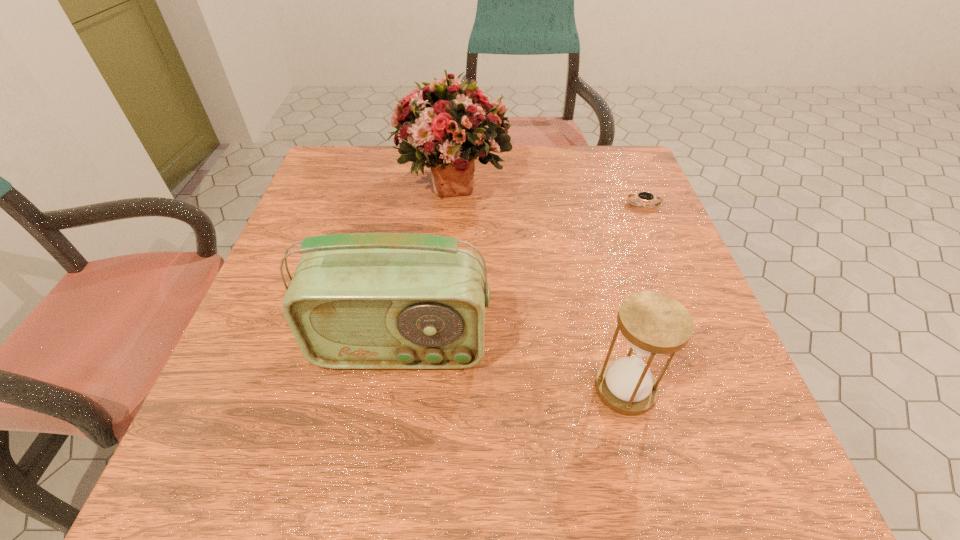
I want to click on bouquet, so click(x=449, y=125).

At what (x,y) coordinates should I click in order to perform the action: click on radio receiver. Please return your answer as a coordinate pair (x, y). The image size is (960, 540). Looking at the image, I should click on (379, 300).

Locate an element on the screen. This screenshot has height=540, width=960. hourglass is located at coordinates (653, 323).

At what (x,y) coordinates should I click in order to perform the action: click on the second shortest object. Please return your answer as a coordinate pair (x, y). Image resolution: width=960 pixels, height=540 pixels. Looking at the image, I should click on (653, 323).

The width and height of the screenshot is (960, 540). Identify the location of watch. (644, 196).

This screenshot has width=960, height=540. Find the location of `the shortest object`. the shortest object is located at coordinates (644, 196).

Where is `vacant space located 0.290m on the front of the bouquet`? The image size is (960, 540). vacant space located 0.290m on the front of the bouquet is located at coordinates (443, 313).

You are a GUI agent. You are given a task and a screenshot of the screen. Output one action in this format:
    pyautogui.click(x=<x>, y=<y>)
    Task: Click on the free space located on the front panel of the radio receiver
    The height and width of the screenshot is (540, 960).
    Given the screenshot: What is the action you would take?
    pyautogui.click(x=386, y=443)

Locate an element on the screen. Image resolution: width=960 pixels, height=540 pixels. blank space located on the back of the third tallest object is located at coordinates (600, 292).

I want to click on vacant area situated on the front of the watch, so click(685, 306).